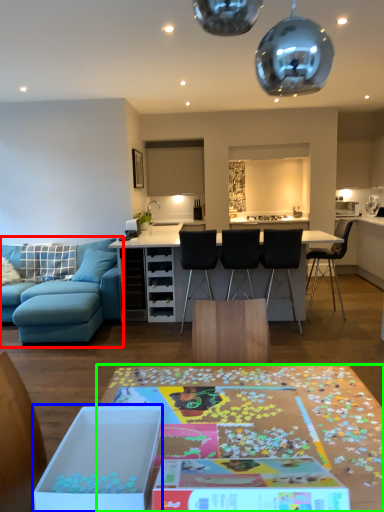
Question: Which is farther away from studio couch (highlighted by a red box)? cardboard box (highlighted by a blue box) or table (highlighted by a green box)?

Choices:
 (A) cardboard box
 (B) table

Answer: (A)